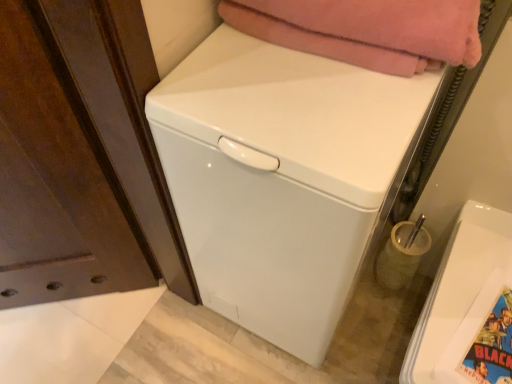
This screenshot has height=384, width=512. I want to click on vacant region in front of translucent glass toothbrush holder at lower right, so click(x=387, y=323).